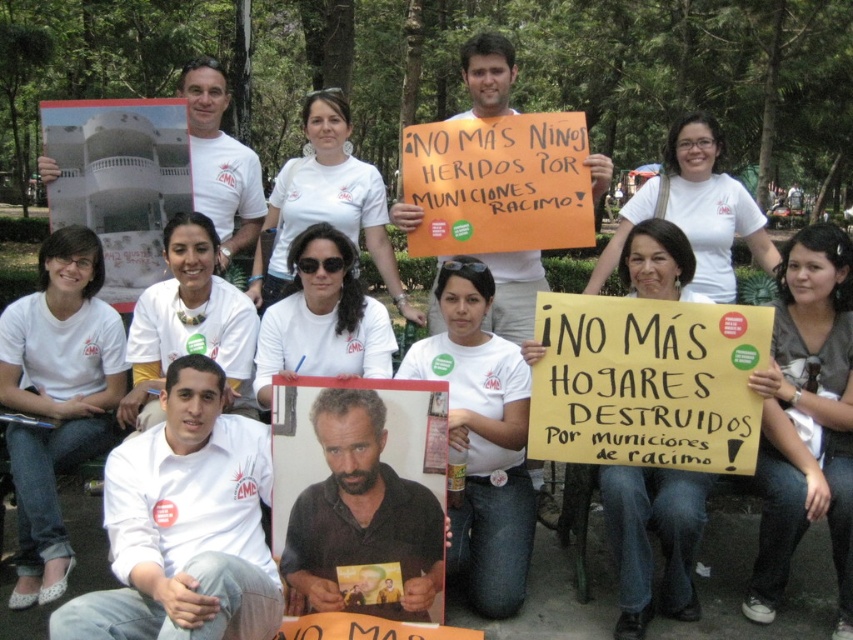
Image resolution: width=853 pixels, height=640 pixels. I want to click on matte cardboard placard at center, so click(x=358, y=477).

Is matte cardboard placard at center positioned before white fabric shirt at lower left?

That is True.

Does point (430, 534) come farther from viewer compared to point (108, 388)?

No, (430, 534) is closer to viewer.

Image resolution: width=853 pixels, height=640 pixels. In order to click on matte cardboard placard at center in this screenshot , I will do `click(358, 477)`.